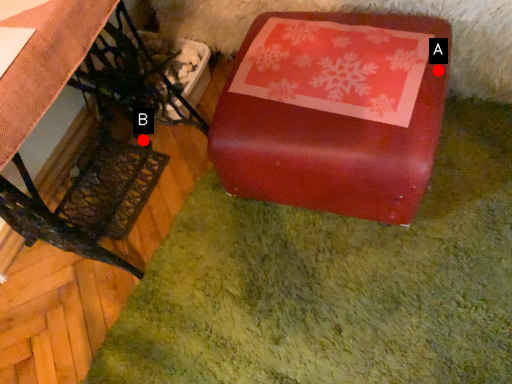
Question: Two points are circled on the image, labeled by A and B beside each circle. Among these points, which one is nearest to the camera?

Choices:
 (A) A is closer
 (B) B is closer

Answer: (A)